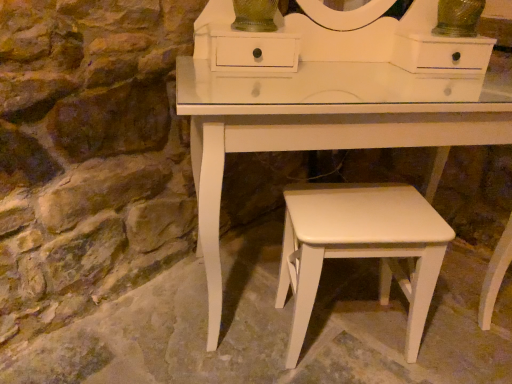
What do you see at coordinates (361, 247) in the screenshot?
I see `white matte stool at center` at bounding box center [361, 247].

Find the location of a particular element. white matte stool at center is located at coordinates (361, 247).

In order to face white matte stool at center, should I rotate leftwards or rightwards?

You should look right and rotate roughly 12.753 degrees.

The height and width of the screenshot is (384, 512). In order to click on white matte stool at center in this screenshot , I will do 361,247.